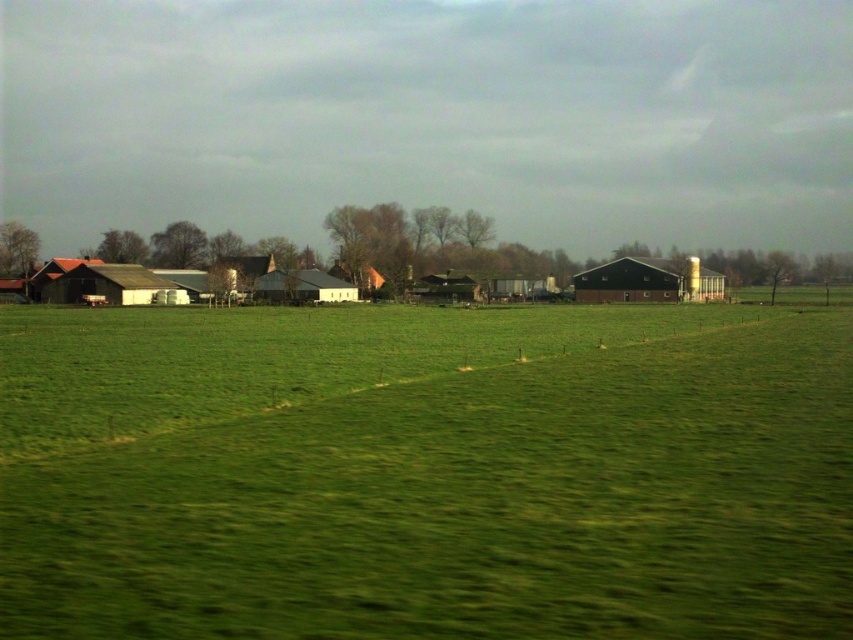
Who is more forward, (587, 284) or (57, 262)?

Point (587, 284) is more forward.

Is point (631, 292) farther from viewer compared to point (56, 259)?

That is False.

The image size is (853, 640). What do you see at coordinates (630, 282) in the screenshot?
I see `dark brown wooden barn at center` at bounding box center [630, 282].

In order to click on dark brown wooden barn at center in this screenshot , I will do `click(630, 282)`.

Can you confirm if green grassy field at center is wider than wooden barn at center?

Correct, the width of green grassy field at center exceeds that of wooden barn at center.

The height and width of the screenshot is (640, 853). What are the coordinates of `green grassy field at center` in the screenshot? It's located at (425, 472).

The width and height of the screenshot is (853, 640). Find the location of `green grassy field at center`. green grassy field at center is located at coordinates pyautogui.click(x=425, y=472).

Does dark brown wooden barn at center have a greater height compared to matte gray barn at center?

Yes.

Does dark brown wooden barn at center have a smaller size compared to matte gray barn at center?

No, dark brown wooden barn at center is not smaller than matte gray barn at center.

The image size is (853, 640). What are the coordinates of `dark brown wooden barn at center` in the screenshot? It's located at (630, 282).